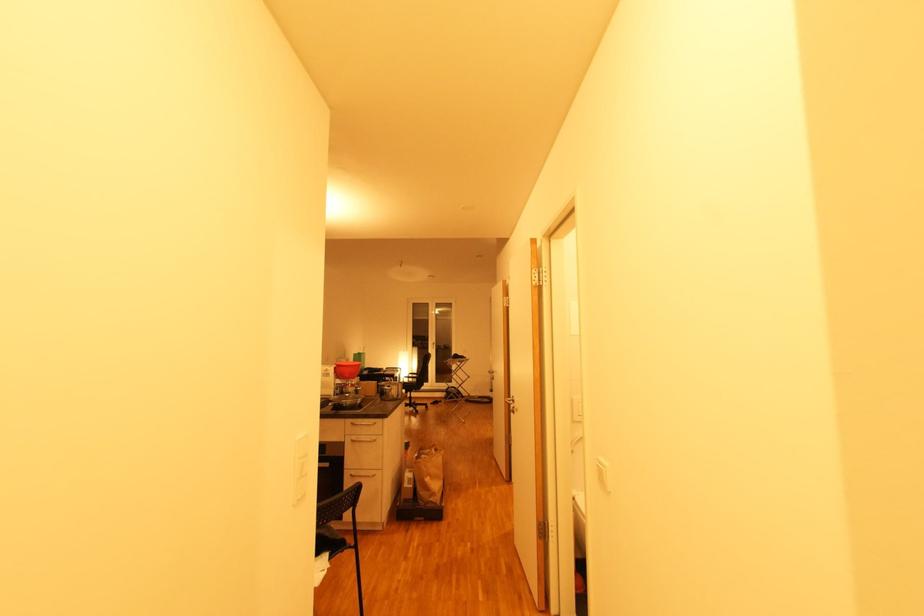
Where would you pull the metal drawer handle? Please return your answer as a coordinate pair (x, y).

(366, 440)